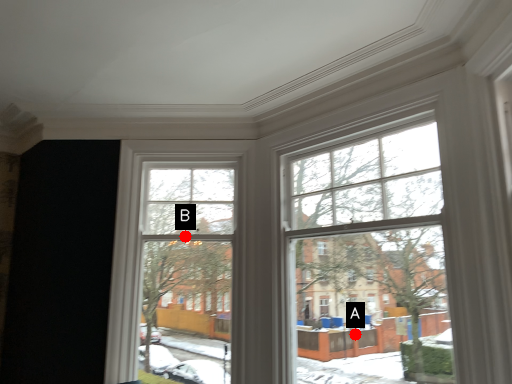
Question: Two points are circled on the image, labeled by A and B beside each circle. Among these points, which one is farthest from the camera?

Choices:
 (A) A is further
 (B) B is further

Answer: (B)